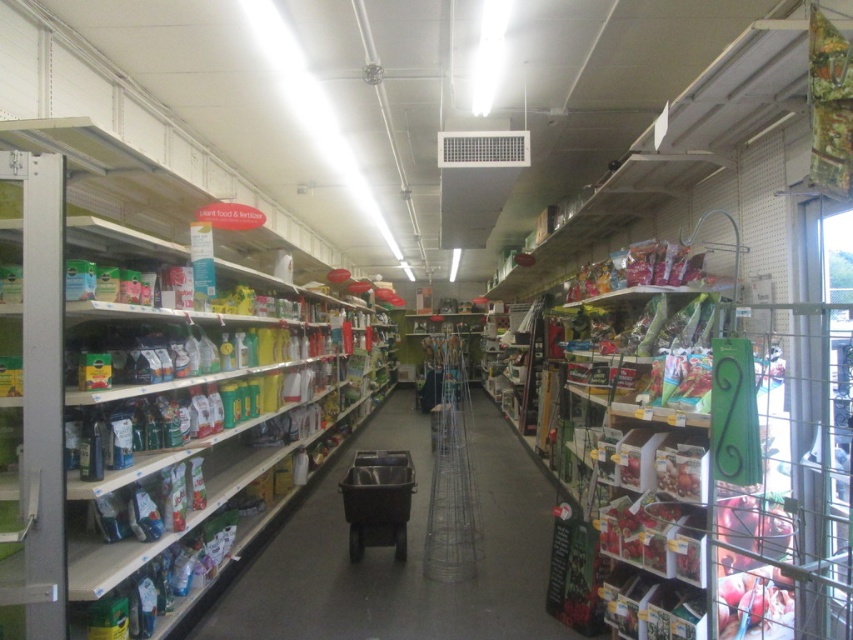
Does metallic silver shelves at left have a smaller size compared to green matte plant food at center?

Incorrect, metallic silver shelves at left is not smaller in size than green matte plant food at center.

I want to click on metallic silver shelves at left, so click(144, 388).

Is green matte plant food at center wider than metallic gray shopping cart at center?

Indeed, green matte plant food at center has a greater width compared to metallic gray shopping cart at center.

This screenshot has height=640, width=853. I want to click on green matte plant food at center, so click(x=407, y=554).

Between point (364, 564) and point (369, 525), which one is positioned in front?

Point (364, 564) is in front.

This screenshot has width=853, height=640. Identify the location of green matte plant food at center. (407, 554).

Between metallic silver shelves at left and metallic gray shopping cart at center, which one has more height?

metallic silver shelves at left is taller.

Does metallic silver shelves at left have a lesser width compared to metallic gray shopping cart at center?

In fact, metallic silver shelves at left might be wider than metallic gray shopping cart at center.

Identify the location of metallic silver shelves at left. The height and width of the screenshot is (640, 853). (144, 388).

What are the coordinates of `metallic silver shelves at left` in the screenshot? It's located at (144, 388).